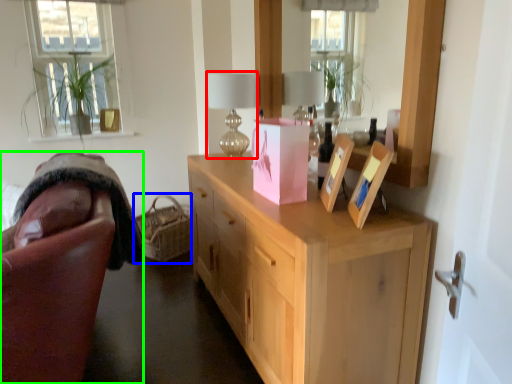
Question: Based on their relative distances, which object is nearer to table lamp (highlighted by a red box)? Choose from basket (highlighted by a blue box) and chair (highlighted by a green box).

Choices:
 (A) basket
 (B) chair

Answer: (B)